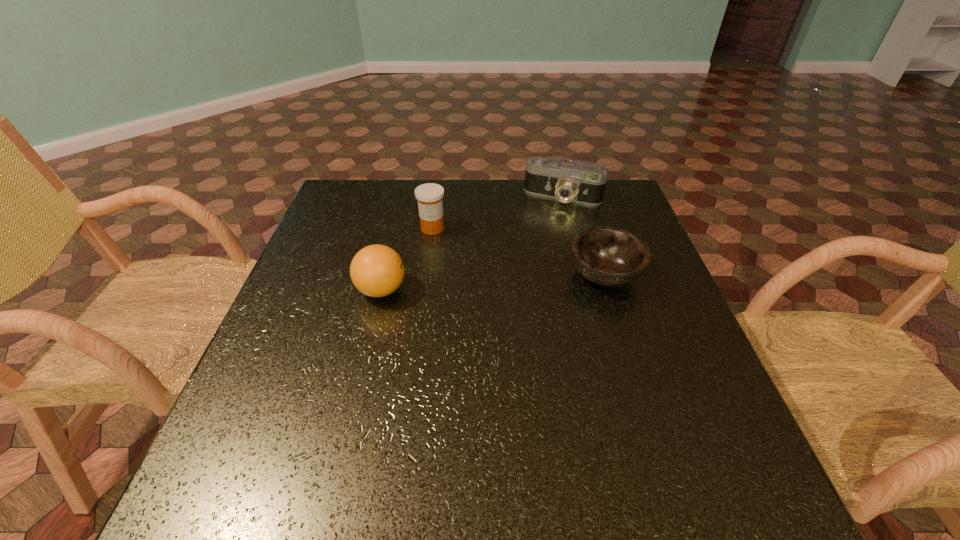
Locate an element on the screen. This screenshot has height=540, width=960. vacant space located 0.150m on the label of the third nearest object is located at coordinates (461, 268).

Locate an element on the screen. vacant space located on the label of the third nearest object is located at coordinates (476, 291).

You are a GUI agent. You are given a task and a screenshot of the screen. Output one action in this format:
    pyautogui.click(x=<x>, y=<y>)
    Task: Click on the free space located 0.050m on the label of the third nearest object
    
    Given the screenshot: What is the action you would take?
    pyautogui.click(x=444, y=246)

Locate an element on the screen. This screenshot has width=960, height=540. camera that is at the far edge is located at coordinates [x=577, y=181].

Where is `medicine present at the far edge`? This screenshot has height=540, width=960. medicine present at the far edge is located at coordinates (430, 204).

I want to click on object that is at the left edge, so click(377, 270).

Image resolution: width=960 pixels, height=540 pixels. I want to click on bowl that is at the right edge, so click(x=607, y=256).

Where is `camera that is at the right edge`? Image resolution: width=960 pixels, height=540 pixels. camera that is at the right edge is located at coordinates (577, 181).

Identify the location of object that is positioned at the far right corner. The image size is (960, 540). (577, 181).

Locate an element on the screen. free space at the far edge of the desktop is located at coordinates (386, 205).